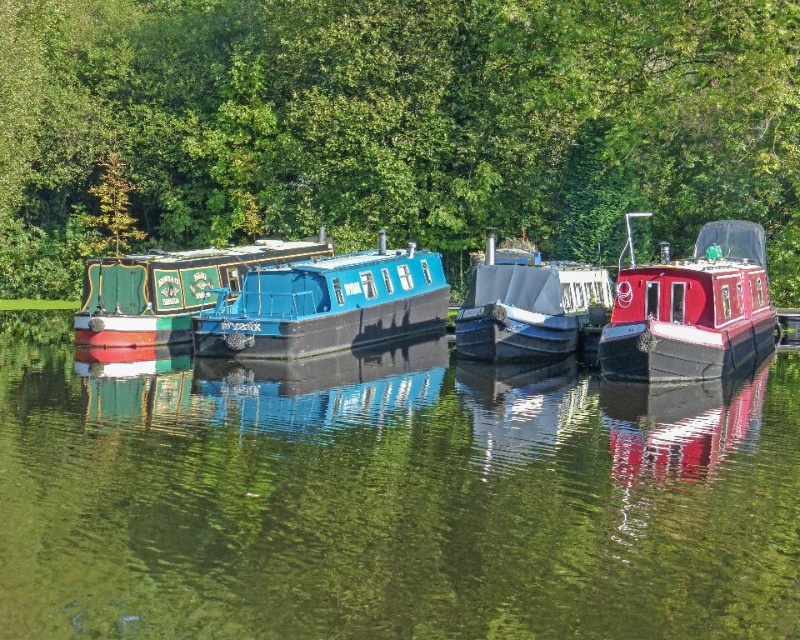
You are standing on the dock observing the green painted wood boat at center and the matte gray cabin cruiser at center. Which boat appears higher in the image?

The green painted wood boat at center is located above the matte gray cabin cruiser at center in the image.

You are standing on the dock and want to board the shiny red boat at right. Based on its position, which direction should you walk to reach it?

The shiny red boat at right is located at point (690, 308), so you should walk towards the right side of the dock to reach it.

You are a photographer planning to capture a wide shot of the green painted wood boat at center and the matte gray cabin cruiser at center. Given their widths, which boat would require more space to fully frame in your photo?

The matte gray cabin cruiser at center requires more space to fully frame in the photo since it is wider than the green painted wood boat at center.